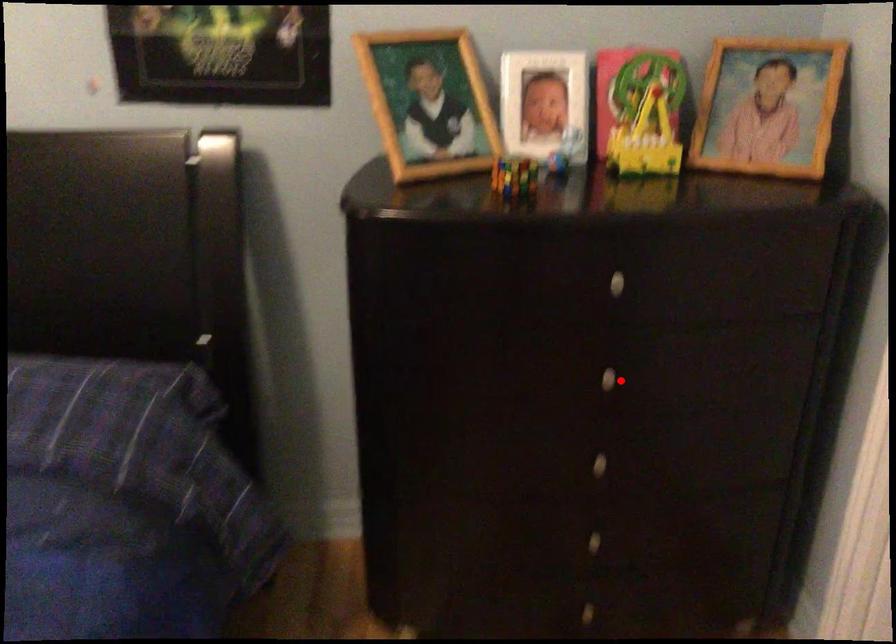
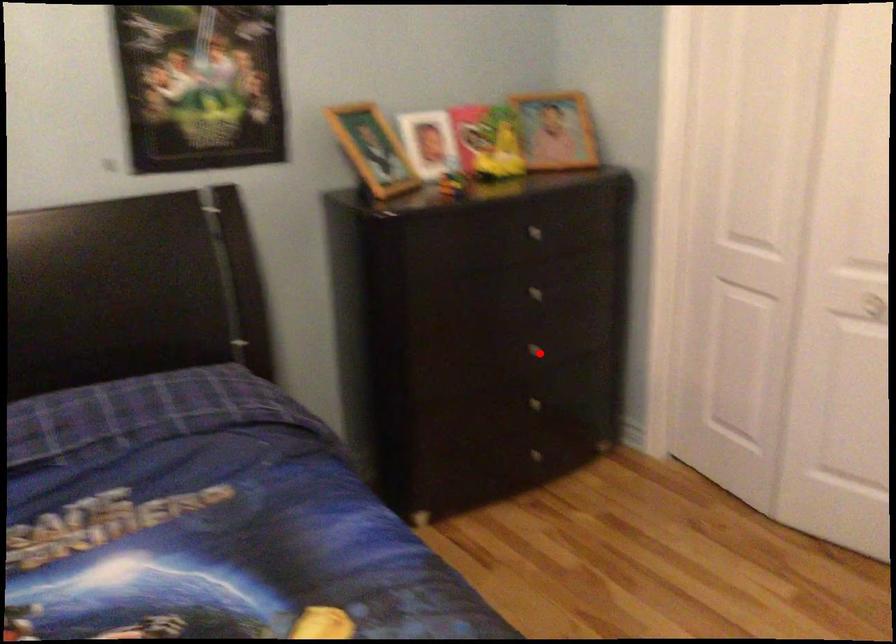
I am providing you with two images of the same scene from different viewpoints. A red point is marked on the first image and another point is marked on the second image. Does the point marked in image1 correspond to the same location as the one in image2?

No